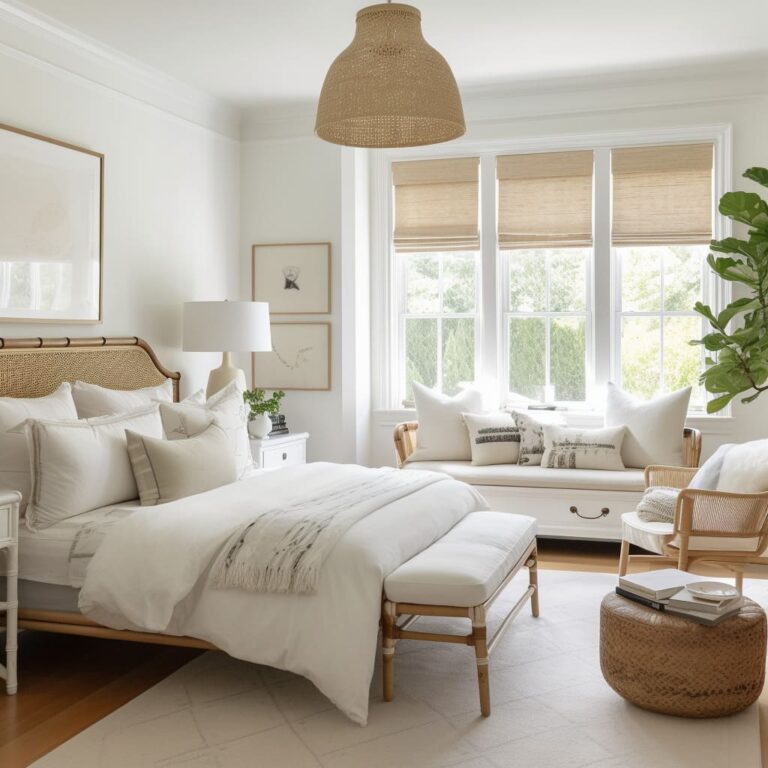
Find the location of a particular element. pillows is located at coordinates (644, 426), (584, 449), (533, 444), (488, 444), (452, 419), (217, 439), (217, 422), (98, 447), (121, 408), (45, 418).